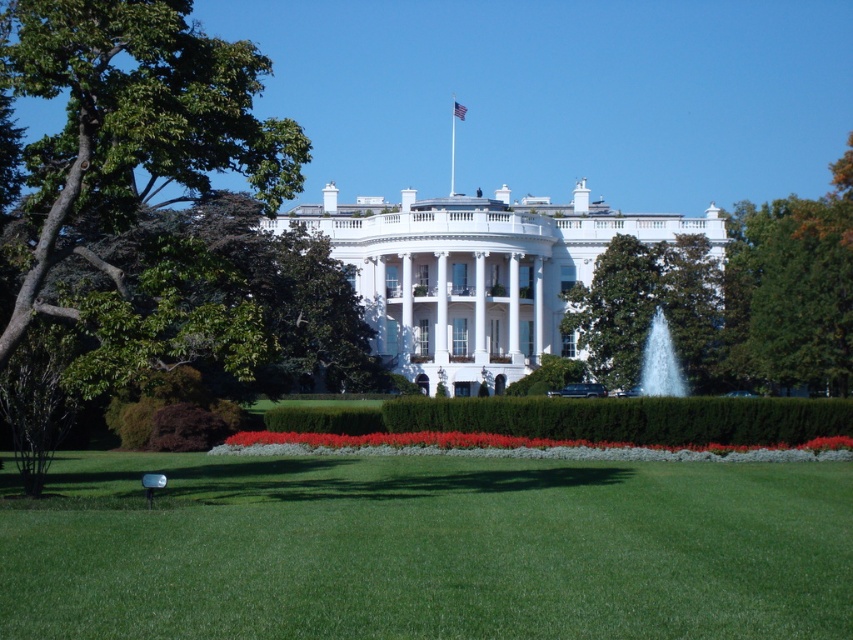
Can you confirm if red velvet flowers at center is shorter than american flag at center?

Yes, red velvet flowers at center is shorter than american flag at center.

Looking at this image, between red velvet flowers at center and american flag at center, which one is positioned lower?

Positioned lower is red velvet flowers at center.

What do you see at coordinates (496, 442) in the screenshot?
I see `red velvet flowers at center` at bounding box center [496, 442].

Locate an element on the screen. The image size is (853, 640). red velvet flowers at center is located at coordinates (496, 442).

Does point (714, 636) lie behind point (810, 342)?

No, it is not.

Does green grass lawn at center have a lesser height compared to green leafy tree at right?

Indeed, green grass lawn at center has a lesser height compared to green leafy tree at right.

Does point (422, 552) come closer to viewer compared to point (796, 305)?

Yes, it is in front of point (796, 305).

The height and width of the screenshot is (640, 853). I want to click on green grass lawn at center, so click(x=426, y=548).

Which is more to the left, green grass lawn at center or red velvet flowers at center?

Positioned to the left is green grass lawn at center.

Is green grass lawn at center thinner than red velvet flowers at center?

No.

Which is in front, point (26, 600) or point (440, 444)?

Point (26, 600) is more forward.

The height and width of the screenshot is (640, 853). I want to click on green grass lawn at center, so click(426, 548).